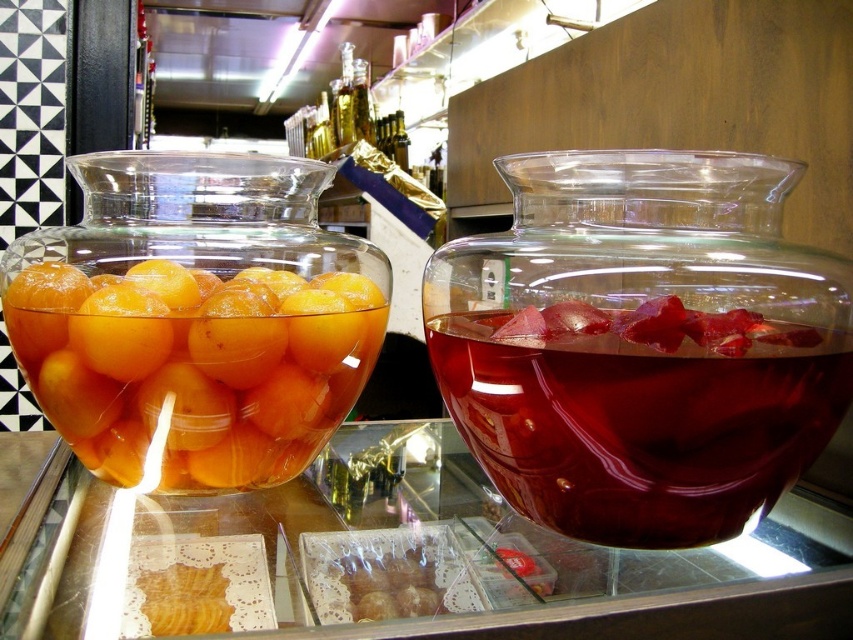
Question: Does matte yellow orange at left appear on the left side of matte yellow orange at center?

Choices:
 (A) yes
 (B) no

Answer: (A)

Question: Is matte yellow orange at left closer to camera compared to matte orange at center?

Choices:
 (A) no
 (B) yes

Answer: (B)

Question: Which of the following is the closest to the observer?

Choices:
 (A) matte yellow orange at center
 (B) matte yellow orange at left

Answer: (B)

Question: From the image, what is the correct spatial relationship of transparent glass jar at right in relation to matte yellow orange at center?

Choices:
 (A) below
 (B) above

Answer: (A)

Question: Which point is farther to the camera?

Choices:
 (A) (334, 428)
 (B) (144, 356)

Answer: (A)

Question: Estimate the real-world distances between objects in this image. Which object is closer to the yellow translucent fruit at left?

Choices:
 (A) matte yellow orange at center
 (B) transparent glass table at center
 (C) transparent glass jar at right
 (D) matte yellow orange at left

Answer: (D)